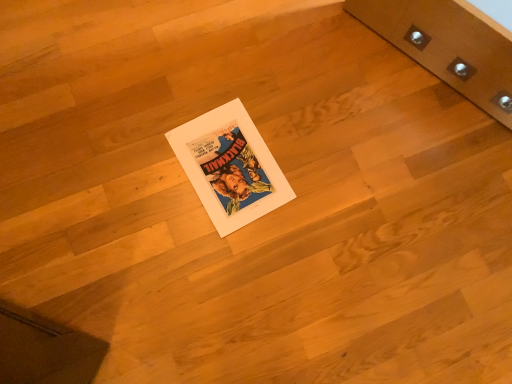
Locate an element on the screen. white paper magazine at center is located at coordinates (230, 167).

Describe the element at coordinates (230, 167) in the screenshot. Image resolution: width=512 pixels, height=384 pixels. I see `white paper magazine at center` at that location.

This screenshot has height=384, width=512. Find the location of `white paper magazine at center`. white paper magazine at center is located at coordinates (230, 167).